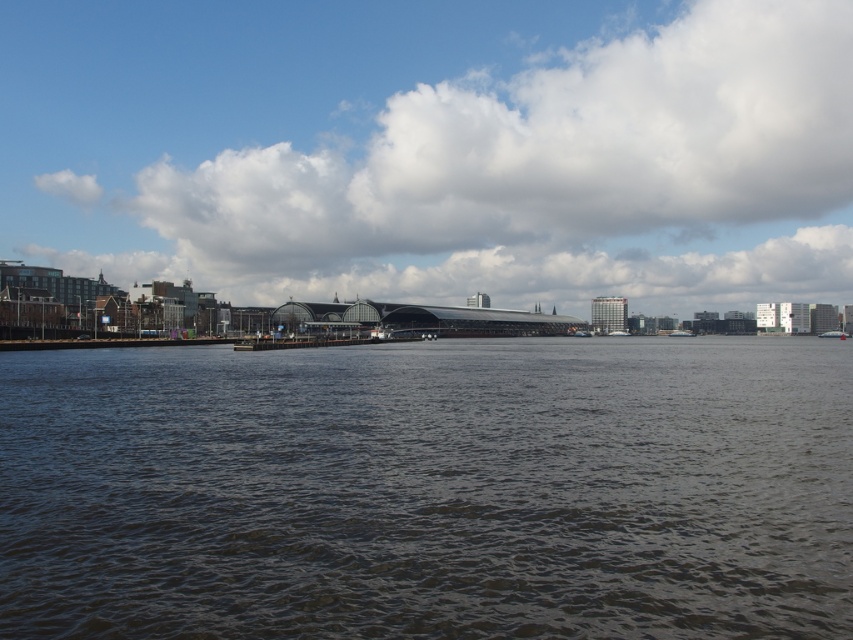
Is white fluffy cloud at upper center to the left of white plastic boat at right from the viewer's perspective?

Indeed, white fluffy cloud at upper center is positioned on the left side of white plastic boat at right.

How much distance is there between white fluffy cloud at upper center and white plastic boat at right?

They are 219.86 meters apart.

Does point (498, 122) come farther from viewer compared to point (828, 336)?

Yes, point (498, 122) is behind point (828, 336).

Image resolution: width=853 pixels, height=640 pixels. Find the location of `white fluffy cloud at upper center`. white fluffy cloud at upper center is located at coordinates (434, 148).

Who is shorter, white fluffy cloud at upper center or metallic silver boat at center?

Standing shorter between the two is metallic silver boat at center.

Is white fluffy cloud at upper center positioned behind metallic silver boat at center?

Yes, it is behind metallic silver boat at center.

Locate an element on the screen. This screenshot has width=853, height=640. white fluffy cloud at upper center is located at coordinates (434, 148).

Where is `white fluffy cloud at upper center`? white fluffy cloud at upper center is located at coordinates (434, 148).

In the scene shown: Does dark water at center appear under white fluffy cloud at upper center?

Indeed, dark water at center is positioned under white fluffy cloud at upper center.

Between dark water at center and white fluffy cloud at upper center, which one is positioned lower?

dark water at center is below.

Find the location of a particular element. Image resolution: width=853 pixels, height=640 pixels. dark water at center is located at coordinates (428, 490).

I want to click on dark water at center, so click(428, 490).